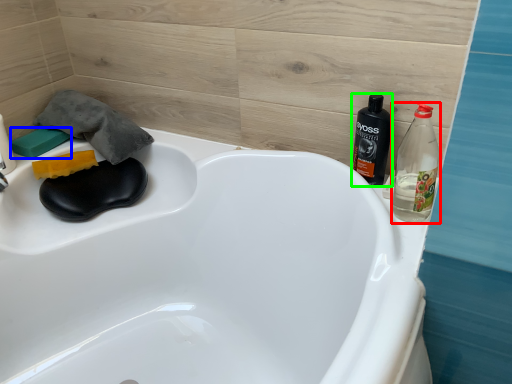
Question: Considering the real-world distances, which object is closest to bottle (highlighted by a red box)? soap (highlighted by a blue box) or bottle (highlighted by a green box).

Choices:
 (A) soap
 (B) bottle

Answer: (B)